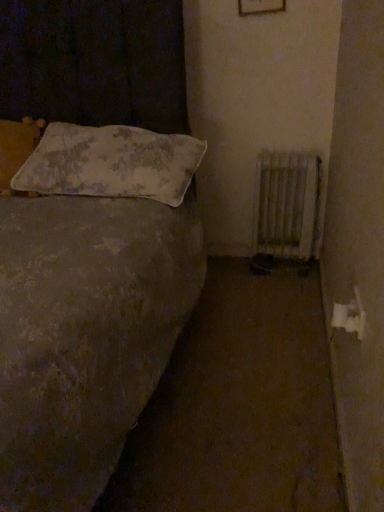
Question: From the image's perspective, is fluffy white pillow at upper left, which ranks as the 2th pillow in left-to-right order, above or below white metallic radiator at lower right?

Choices:
 (A) below
 (B) above

Answer: (B)

Question: Is point (140, 157) positioned closer to the camera than point (296, 227)?

Choices:
 (A) closer
 (B) farther

Answer: (A)

Question: Which object is the farthest from the white metallic radiator at lower right?

Choices:
 (A) fluffy white pillow at upper left, which appears as the second pillow when viewed from the right
 (B) fluffy white pillow at upper left, which ranks as the 2th pillow in left-to-right order
 (C) wooden frame at upper center

Answer: (A)

Question: Which of these objects is positioned farthest from the fluffy white pillow at upper left, positioned as the 1th pillow in right-to-left order?

Choices:
 (A) wooden frame at upper center
 (B) white metallic radiator at lower right
 (C) fluffy white pillow at upper left, which appears as the second pillow when viewed from the right

Answer: (A)